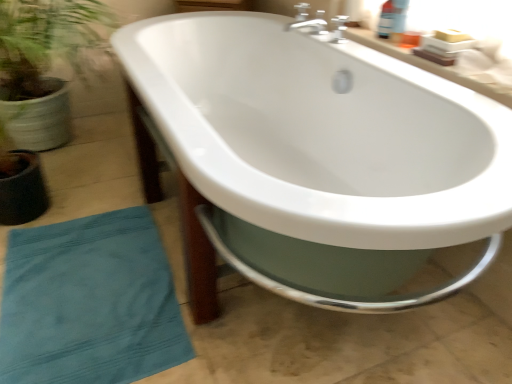
Question: Is white glossy countertop at upper right not close to teal cotton beach towel at lower left?

Choices:
 (A) no
 (B) yes

Answer: (B)

Question: Is white glossy countertop at upper right smaller than teal cotton beach towel at lower left?

Choices:
 (A) yes
 (B) no

Answer: (A)

Question: Can teal cotton beach towel at lower left be found inside white glossy countertop at upper right?

Choices:
 (A) yes
 (B) no

Answer: (B)

Question: Does white glossy countertop at upper right have a greater height compared to teal cotton beach towel at lower left?

Choices:
 (A) no
 (B) yes

Answer: (A)

Question: Does white glossy countertop at upper right touch teal cotton beach towel at lower left?

Choices:
 (A) yes
 (B) no

Answer: (B)

Question: Is white glossy countertop at upper right turned away from teal cotton beach towel at lower left?

Choices:
 (A) no
 (B) yes

Answer: (A)

Question: Is white glossy countertop at upper right further to camera compared to white glossy bathtub at center?

Choices:
 (A) no
 (B) yes

Answer: (B)

Question: From a real-world perspective, is white glossy countertop at upper right on white glossy bathtub at center?

Choices:
 (A) yes
 (B) no

Answer: (A)

Question: Is white glossy countertop at upper right outside of white glossy bathtub at center?

Choices:
 (A) no
 (B) yes

Answer: (B)

Question: Is white glossy countertop at upper right positioned before white glossy bathtub at center?

Choices:
 (A) no
 (B) yes

Answer: (A)

Question: Does white glossy countertop at upper right touch white glossy bathtub at center?

Choices:
 (A) yes
 (B) no

Answer: (B)

Question: Is white glossy countertop at upper right wider than white glossy bathtub at center?

Choices:
 (A) no
 (B) yes

Answer: (A)

Question: Does white glossy bathtub at center have a larger size compared to white glossy countertop at upper right?

Choices:
 (A) yes
 (B) no

Answer: (A)